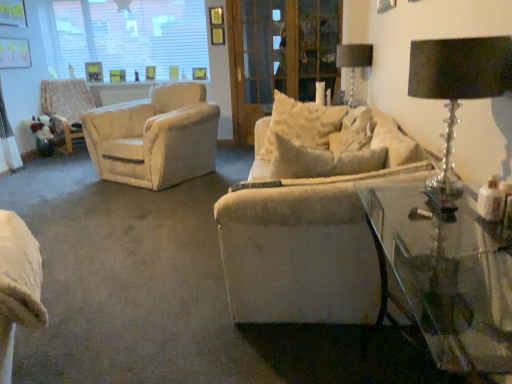
Question: Is transparent glass table at lower right wider than metallic glass table lamp at upper right, marked as the 1th table lamp in a top-to-bottom arrangement?

Choices:
 (A) yes
 (B) no

Answer: (A)

Question: From a real-world perspective, is transparent glass table at lower right beneath metallic glass table lamp at upper right, the first table lamp when ordered from back to front?

Choices:
 (A) yes
 (B) no

Answer: (A)

Question: Is the position of transparent glass table at lower right less distant than that of metallic glass table lamp at upper right, marked as the 1th table lamp in a top-to-bottom arrangement?

Choices:
 (A) no
 (B) yes

Answer: (B)

Question: Would you say transparent glass table at lower right is a long distance from metallic glass table lamp at upper right, the first table lamp when ordered from back to front?

Choices:
 (A) yes
 (B) no

Answer: (A)

Question: Is transparent glass table at lower right shorter than metallic glass table lamp at upper right, marked as the second table lamp in a front-to-back arrangement?

Choices:
 (A) no
 (B) yes

Answer: (A)

Question: From the image's perspective, is metallic glass table lamp at upper right, acting as the second table lamp starting from the bottom, positioned above or below white textured chair at left?

Choices:
 (A) below
 (B) above

Answer: (A)

Question: Relative to white textured chair at left, is metallic glass table lamp at upper right, acting as the second table lamp starting from the bottom, in front or behind?

Choices:
 (A) front
 (B) behind

Answer: (A)

Question: Does point (342, 44) appear closer or farther from the camera than point (74, 110)?

Choices:
 (A) farther
 (B) closer

Answer: (B)

Question: Looking at their shapes, would you say metallic glass table lamp at upper right, marked as the second table lamp in a front-to-back arrangement, is wider or thinner than white textured chair at left?

Choices:
 (A) thin
 (B) wide

Answer: (A)

Question: Is white textured chair at left inside the boundaries of transparent glass table at lower right, or outside?

Choices:
 (A) inside
 (B) outside

Answer: (B)

Question: In terms of height, does white textured chair at left look taller or shorter compared to transparent glass table at lower right?

Choices:
 (A) short
 (B) tall

Answer: (B)

Question: Considering the positions of white textured chair at left and transparent glass table at lower right in the image, is white textured chair at left bigger or smaller than transparent glass table at lower right?

Choices:
 (A) small
 (B) big

Answer: (B)

Question: Does point (53, 91) appear closer or farther from the camera than point (410, 238)?

Choices:
 (A) farther
 (B) closer

Answer: (A)

Question: In the image, is transparent glass window at upper left positioned in front of or behind white textured chair at left?

Choices:
 (A) behind
 (B) front

Answer: (A)

Question: Is transparent glass window at upper left inside or outside of white textured chair at left?

Choices:
 (A) outside
 (B) inside

Answer: (A)